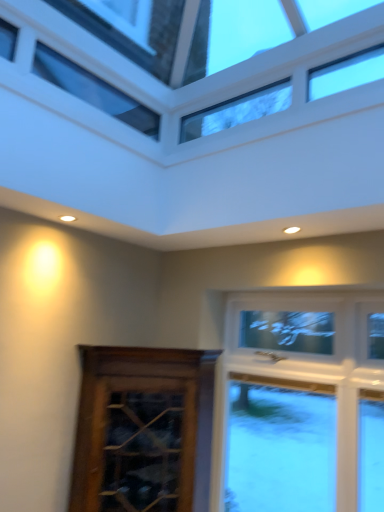
Question: From a real-world perspective, is brown wooden cabinet at lower left beneath transparent glass window at upper center?

Choices:
 (A) no
 (B) yes

Answer: (B)

Question: Is brown wooden cabinet at lower left to the left of transparent glass window at upper center from the viewer's perspective?

Choices:
 (A) yes
 (B) no

Answer: (A)

Question: Is brown wooden cabinet at lower left looking in the opposite direction of transparent glass window at upper center?

Choices:
 (A) yes
 (B) no

Answer: (B)

Question: Is brown wooden cabinet at lower left to the right of transparent glass window at upper center from the viewer's perspective?

Choices:
 (A) yes
 (B) no

Answer: (B)

Question: Can you confirm if brown wooden cabinet at lower left is thinner than transparent glass window at upper center?

Choices:
 (A) no
 (B) yes

Answer: (B)

Question: Can you confirm if brown wooden cabinet at lower left is taller than transparent glass window at upper center?

Choices:
 (A) no
 (B) yes

Answer: (B)

Question: From a real-world perspective, is transparent glass window at upper center on top of brown wooden cabinet at lower left?

Choices:
 (A) yes
 (B) no

Answer: (A)

Question: Does transparent glass window at upper center appear on the left side of brown wooden cabinet at lower left?

Choices:
 (A) yes
 (B) no

Answer: (B)

Question: Considering the relative sizes of transparent glass window at upper center and brown wooden cabinet at lower left in the image provided, is transparent glass window at upper center bigger than brown wooden cabinet at lower left?

Choices:
 (A) yes
 (B) no

Answer: (B)

Question: Does transparent glass window at upper center come in front of brown wooden cabinet at lower left?

Choices:
 (A) yes
 (B) no

Answer: (A)

Question: Is transparent glass window at upper center wider than brown wooden cabinet at lower left?

Choices:
 (A) no
 (B) yes

Answer: (B)

Question: Is transparent glass window at upper center at the right side of brown wooden cabinet at lower left?

Choices:
 (A) no
 (B) yes

Answer: (B)

Question: Is point (137, 509) closer or farther from the camera than point (213, 98)?

Choices:
 (A) closer
 (B) farther

Answer: (A)